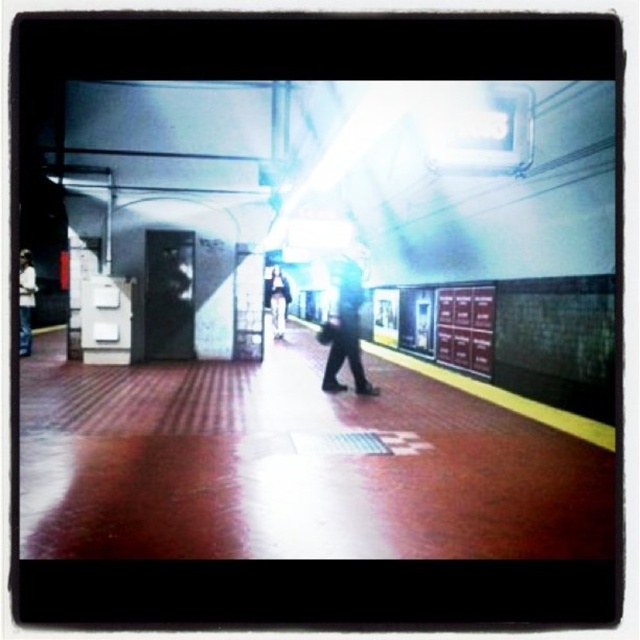
Question: Can you confirm if matte black jacket at left is smaller than light brown leather jacket at center?

Choices:
 (A) no
 (B) yes

Answer: (A)

Question: Which point is farther to the camera?

Choices:
 (A) dark gray pants at center
 (B) matte black jacket at left
 (C) light brown leather jacket at center
 (D) shiny metallic platform at center

Answer: (C)

Question: Among these objects, which one is nearest to the camera?

Choices:
 (A) shiny metallic platform at center
 (B) dark gray pants at center

Answer: (A)

Question: Can you confirm if matte black jacket at left is positioned below light brown leather jacket at center?

Choices:
 (A) yes
 (B) no

Answer: (A)

Question: Does matte black jacket at left have a lesser width compared to light brown leather jacket at center?

Choices:
 (A) yes
 (B) no

Answer: (B)

Question: Which object appears closest to the camera in this image?

Choices:
 (A) light brown leather jacket at center
 (B) matte black jacket at left
 (C) dark gray pants at center
 (D) shiny metallic platform at center

Answer: (D)